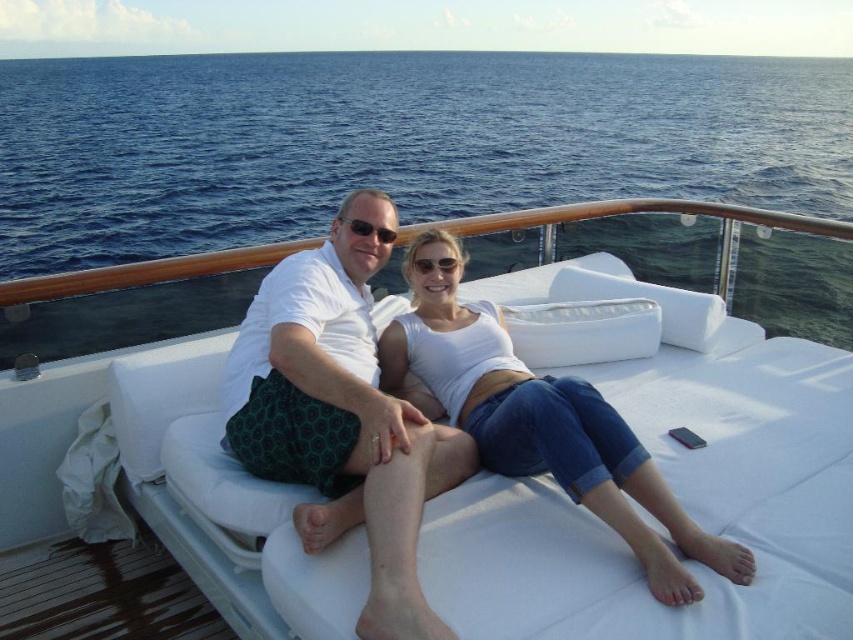
Can you confirm if white cotton shirt at center is positioned above white cotton tank top at center?

Incorrect, white cotton shirt at center is not positioned above white cotton tank top at center.

Is point (363, 632) more distant than point (442, 410)?

No.

Locate an element on the screen. white cotton shirt at center is located at coordinates (340, 422).

Is the position of white cotton tank top at center less distant than that of denim at center?

No, it is behind denim at center.

Image resolution: width=853 pixels, height=640 pixels. Describe the element at coordinates (612, 484) in the screenshot. I see `white cotton tank top at center` at that location.

Identify the location of white cotton tank top at center. (612, 484).

Looking at this image, is white cotton shirt at center closer to the viewer compared to matte black sunglasses at upper center?

Yes.

Who is more forward, (299, 372) or (376, 228)?

Positioned in front is point (299, 372).

At what (x,y) coordinates should I click in order to perform the action: click on white cotton shirt at center. Please return your answer as a coordinate pair (x, y). Looking at the image, I should click on (340, 422).